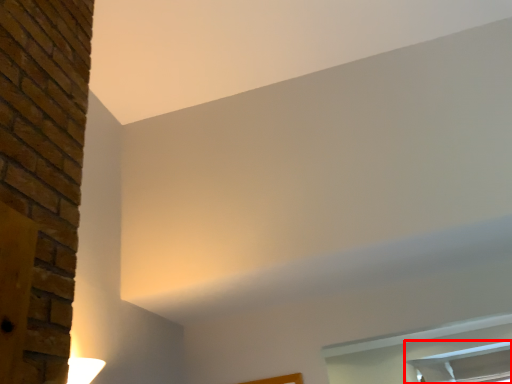
Question: From the image's perspective, considering the relative positions of window (annotated by the red box) and window in the image provided, where is window (annotated by the red box) located with respect to the staircase?

Choices:
 (A) above
 (B) below

Answer: (B)